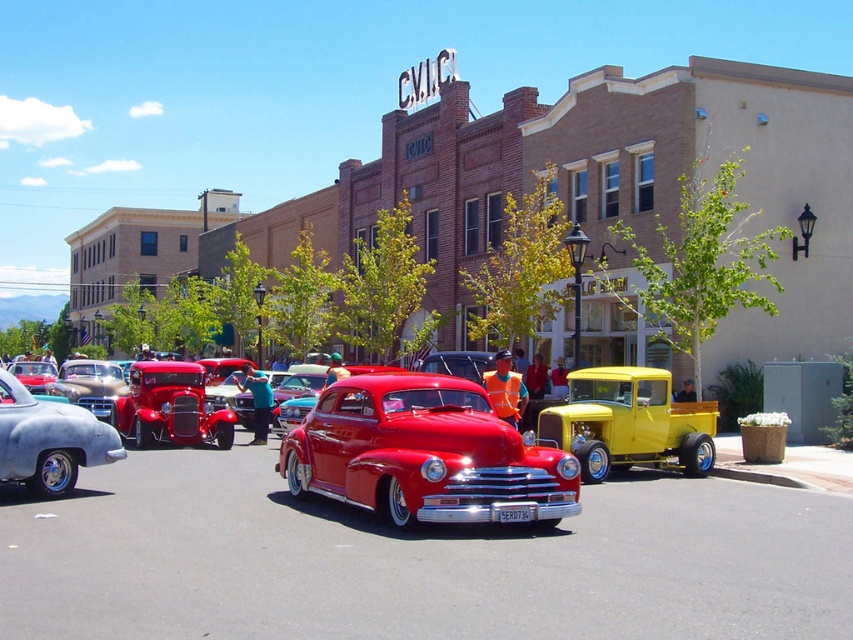
Question: Among these objects, which one is farthest from the camera?

Choices:
 (A) shiny red car at center
 (B) glossy metal car at center
 (C) matte silver car at lower left

Answer: (C)

Question: In this image, where is yellow wood pickup truck at center located relative to matte silver car at lower left?

Choices:
 (A) above
 (B) below

Answer: (B)

Question: Can you confirm if yellow wood pickup truck at center is wider than matte silver car at lower left?

Choices:
 (A) no
 (B) yes

Answer: (B)

Question: Is shiny red car at center smaller than yellow wood pickup truck at center?

Choices:
 (A) yes
 (B) no

Answer: (B)

Question: Which of the following is the farthest from the observer?

Choices:
 (A) glossy metal car at center
 (B) yellow wood pickup truck at center
 (C) shiny red car at center

Answer: (B)

Question: Among these points, which one is farthest from the camera?

Choices:
 (A) (x=453, y=518)
 (B) (x=453, y=422)

Answer: (B)